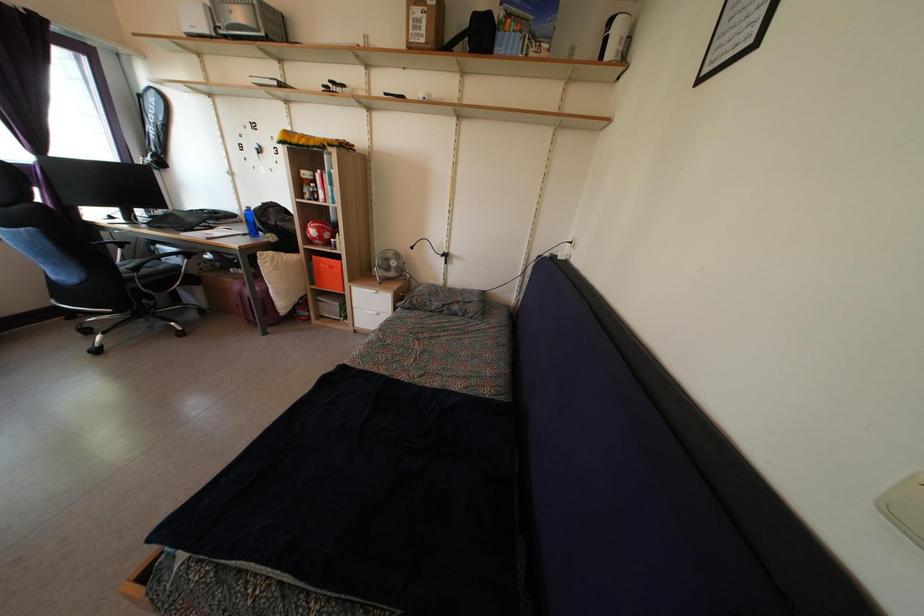
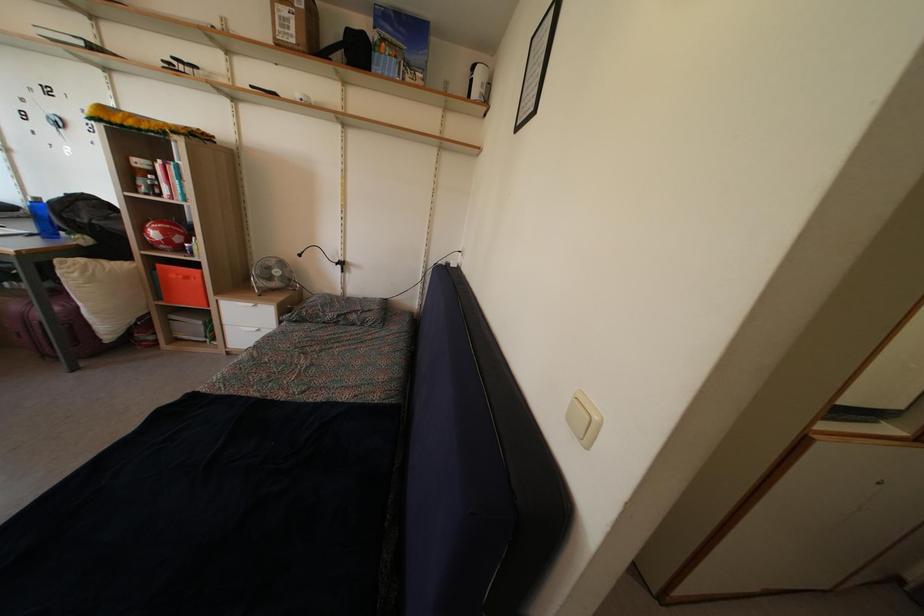
In the second image, find the point that corresponds to point 426,49 in the first image.

(296, 50)